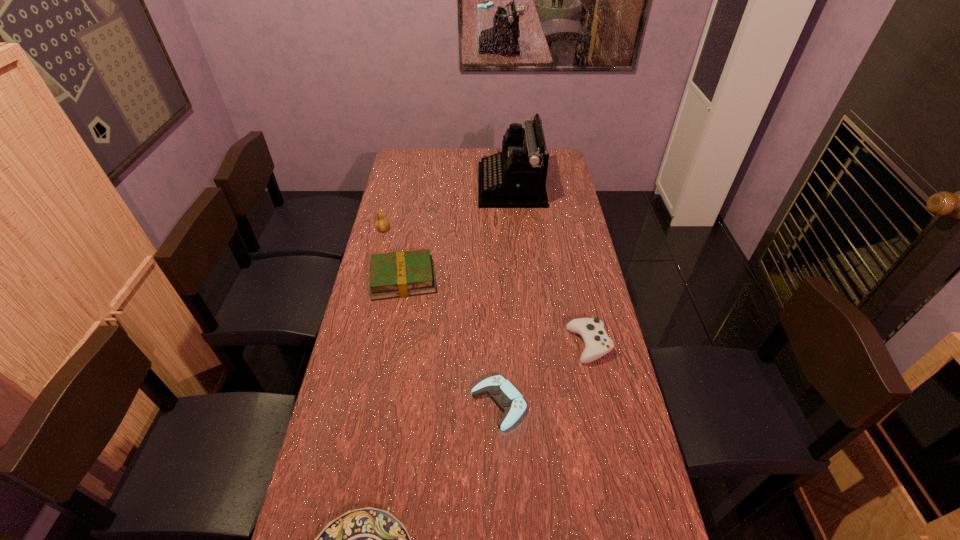
The image size is (960, 540). Find the location of `vacant region located 0.330m on the typing side of the tallest object`. vacant region located 0.330m on the typing side of the tallest object is located at coordinates (408, 186).

You are a GUI agent. You are given a task and a screenshot of the screen. Output one action in this format:
    pyautogui.click(x=<x>, y=<y>)
    Task: Click on the vacant space located on the typing side of the tallest object
    Image resolution: width=960 pixels, height=540 pixels.
    Given the screenshot: What is the action you would take?
    pyautogui.click(x=396, y=186)

You are a GUI agent. You are given a task and a screenshot of the screen. Output one action in this format:
    pyautogui.click(x=<x>, y=<y>)
    Task: Click on the vacant region located on the right of the fifth shortest object
    Image resolution: width=960 pixels, height=540 pixels.
    Given the screenshot: What is the action you would take?
    pyautogui.click(x=441, y=230)

This screenshot has width=960, height=540. In order to click on free point located on the front of the book in this screenshot , I will do `click(395, 328)`.

Identify the location of vacant space located 0.220m on the front of the farther control. The height and width of the screenshot is (540, 960). (608, 434).

Locate an element on the screen. This screenshot has height=540, width=960. free space located 0.220m on the left of the shorter control is located at coordinates (396, 404).

Find the location of `object that is at the far edge`. object that is at the far edge is located at coordinates (516, 177).

Locate an element on the screen. The width and height of the screenshot is (960, 540). pear at the left edge is located at coordinates (382, 223).

Image resolution: width=960 pixels, height=540 pixels. I want to click on book that is at the left edge, so click(407, 273).

This screenshot has width=960, height=540. Find the location of `typewriter that is at the right edge`. typewriter that is at the right edge is located at coordinates (516, 177).